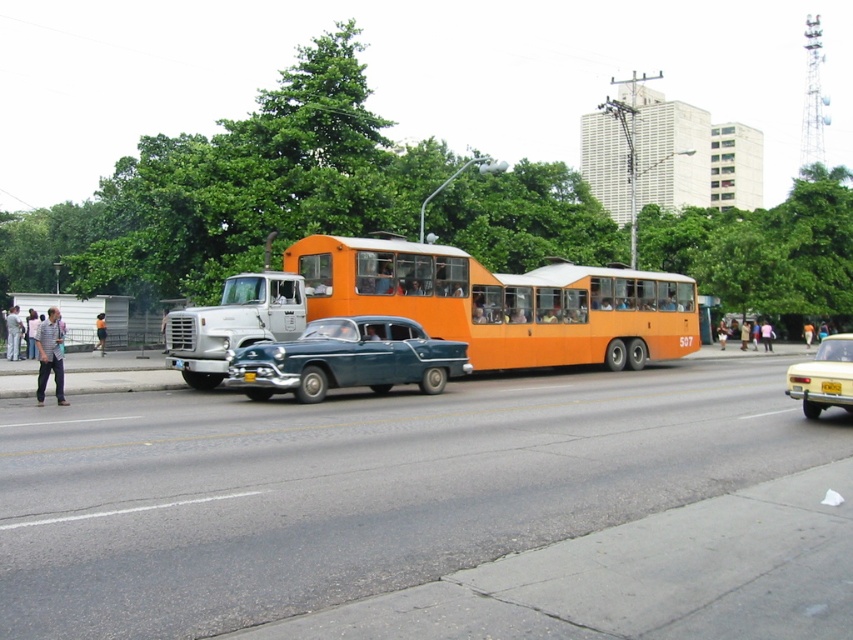
You are standing on the sidewalk and see the vintage orange bus labeled 507 and the point at coordinate [354,355]. Which one is closer to you?

The point at coordinate [354,355] is 17.55 meters away from the viewer, so the vintage orange bus labeled 507 is closer to you than the point at coordinate [354,355].

You are standing on the sidewalk and see the shiny blue sedan at center. You want to cross the street to reach the vintage orange bus labeled 507. The road is 30 feet wide. Can you safely cross before the bus passes by if it is currently 100 feet away from you?

The shiny blue sedan at center is 53.57 feet away from the viewer. Since the road is 30 feet wide, you need to cross 30 feet to reach the other side. The bus is 100 feet away from you, so there is enough time to cross safely before the bus arrives.